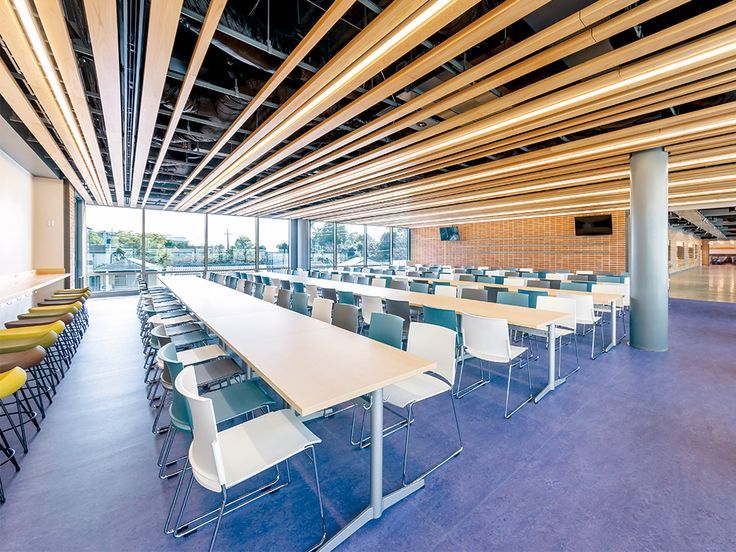
Locate an element on the screen. The image size is (736, 552). tables is located at coordinates (35, 283), (269, 334), (491, 310), (604, 301).